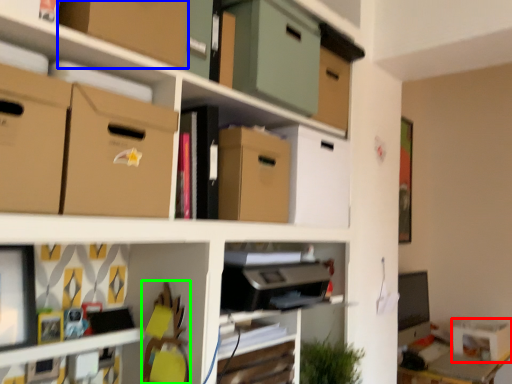
Question: Which object is the farthest from storage box (highlighted by a red box)? Choose among these: cardboard box (highlighted by a blue box) or swivel chair (highlighted by a green box).

Choices:
 (A) cardboard box
 (B) swivel chair

Answer: (A)